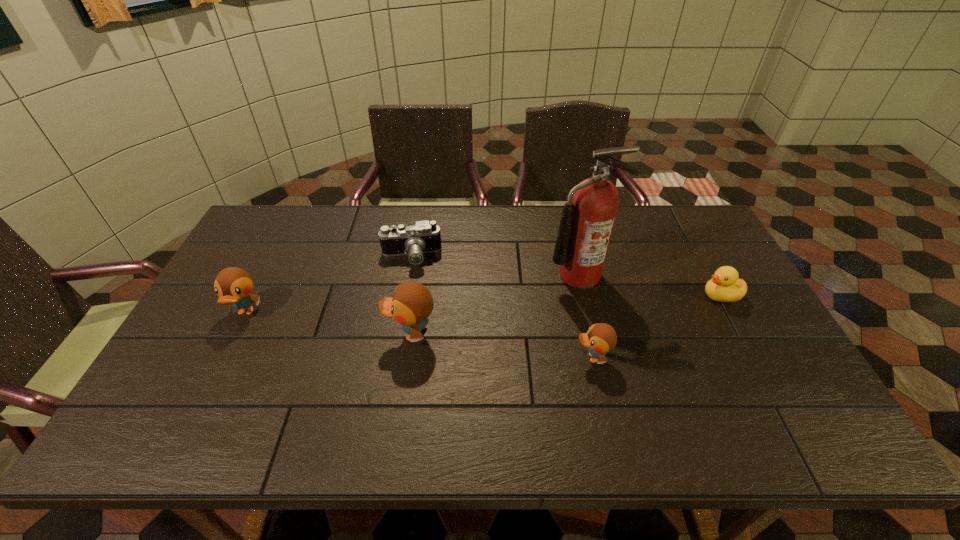
This screenshot has width=960, height=540. What are the coordinates of `object that is positioned at the far edge` in the screenshot? It's located at (414, 239).

Locate an element on the screen. The width and height of the screenshot is (960, 540). object present at the left edge is located at coordinates (233, 285).

Where is `object that is positioned at the right edge`? object that is positioned at the right edge is located at coordinates (724, 286).

In the image, there is a desktop. What are the coordinates of `free region at the far edge` in the screenshot? It's located at (313, 236).

Locate an element on the screen. The height and width of the screenshot is (540, 960). free space at the left edge of the desktop is located at coordinates (195, 339).

Image resolution: width=960 pixels, height=540 pixels. In the image, there is a desktop. Identify the location of blank space at the right edge. (717, 345).

The image size is (960, 540). In order to click on free space at the far left corner in this screenshot , I will do `click(296, 227)`.

Identify the location of vacant area that lies between the fifth shortest object and the third duck from left to right. The width and height of the screenshot is (960, 540). (501, 346).

The width and height of the screenshot is (960, 540). I want to click on free space between the rightmost duck and the second duck from right to left, so click(657, 327).

Locate an element on the screen. This screenshot has height=540, width=960. vacant space that is in between the third duck from left to right and the camera is located at coordinates (502, 307).